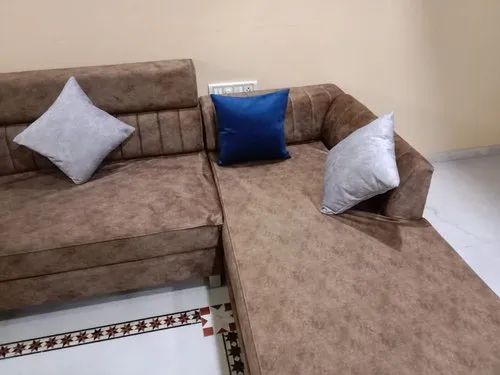
Where is `gray floor`? gray floor is located at coordinates (470, 210).